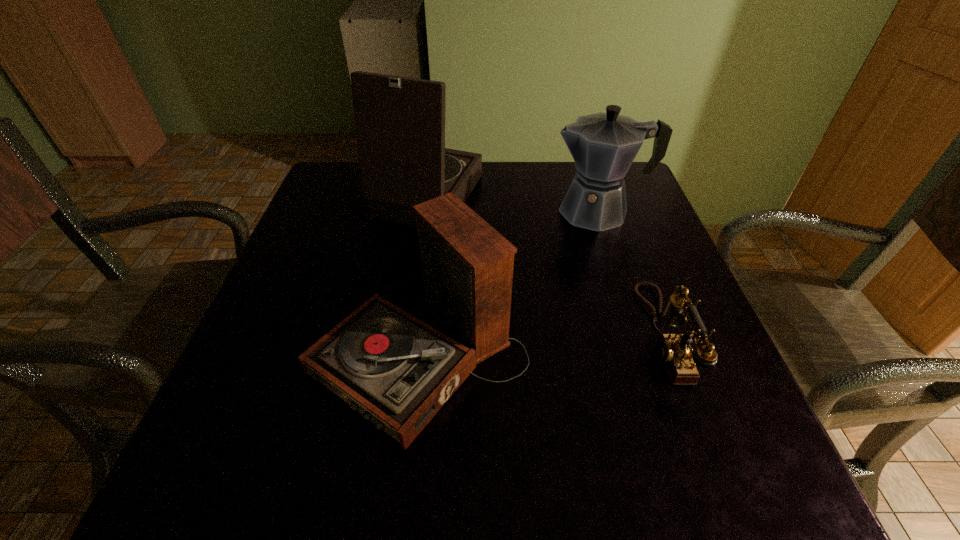
The width and height of the screenshot is (960, 540). Identify the location of object located at the near left corner. point(397,371).

Where is `object that is at the far right corner`? The width and height of the screenshot is (960, 540). object that is at the far right corner is located at coordinates (603, 145).

This screenshot has width=960, height=540. I want to click on blank space at the far edge of the desktop, so click(x=559, y=166).

The width and height of the screenshot is (960, 540). What are the coordinates of `vacant space at the near edge of the desktop` in the screenshot? It's located at (386, 439).

Find the location of a particular element. Image resolution: width=960 pixels, height=540 pixels. vacant space at the left edge of the desktop is located at coordinates [x=316, y=387].

In the image, there is a desktop. Identify the location of free space at the right edge. This screenshot has width=960, height=540. (715, 400).

Locate an element on the screen. Image resolution: width=960 pixels, height=540 pixels. free point at the far right corner is located at coordinates (633, 167).

I want to click on vacant area at the near right corner of the desktop, so click(652, 442).

I want to click on free spot between the coffeepot and the tallest object, so click(512, 204).

Where is `vacant region between the shortest object and the taller phonograph record`? The height and width of the screenshot is (540, 960). vacant region between the shortest object and the taller phonograph record is located at coordinates (543, 266).